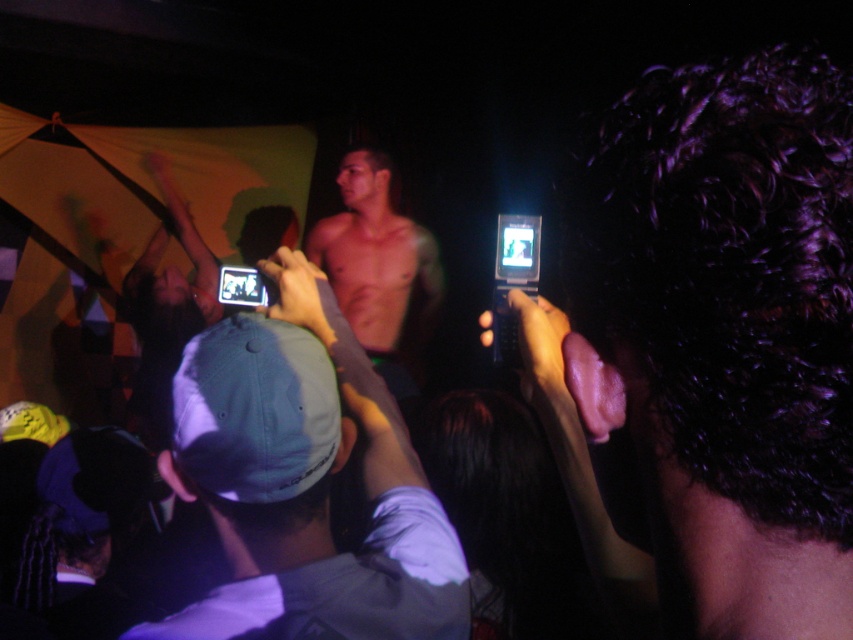
Between gray fabric cap at center and smooth skin torso at center, which one has more height?

smooth skin torso at center is taller.

Is gray fabric cap at center in front of smooth skin torso at center?

Yes.

Is point (433, 509) farther from viewer compared to point (340, 193)?

No.

The height and width of the screenshot is (640, 853). I want to click on gray fabric cap at center, so click(x=305, y=481).

Does shiny black phone at center appear on the right side of gray fabric cap at center?

Indeed, shiny black phone at center is positioned on the right side of gray fabric cap at center.

The image size is (853, 640). What do you see at coordinates (712, 348) in the screenshot?
I see `shiny black phone at center` at bounding box center [712, 348].

At what (x,y) coordinates should I click in order to perform the action: click on shiny black phone at center. Please return your answer as a coordinate pair (x, y). This screenshot has width=853, height=640. Looking at the image, I should click on (712, 348).

This screenshot has height=640, width=853. In order to click on shiny black phone at center in this screenshot , I will do `click(712, 348)`.

Identify the location of shiny black phone at center. Image resolution: width=853 pixels, height=640 pixels. (712, 348).

Who is shorter, shiny black phone at center or smooth skin torso at center?

shiny black phone at center is shorter.

This screenshot has width=853, height=640. I want to click on shiny black phone at center, so click(712, 348).

This screenshot has height=640, width=853. In order to click on shiny black phone at center in this screenshot , I will do `click(712, 348)`.